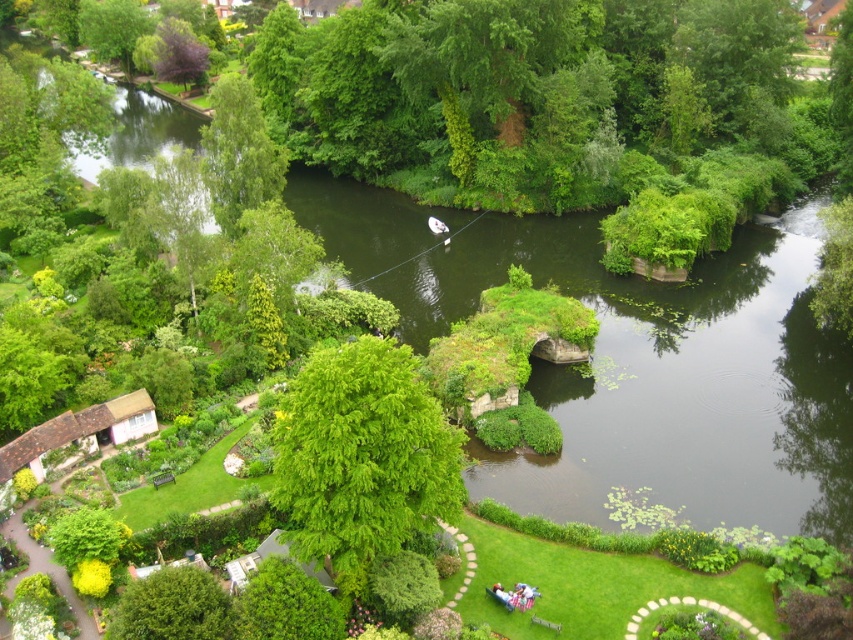
Question: Which object appears farthest from the camera in this image?

Choices:
 (A) green leafy tree at center
 (B) green leafy tree at lower left
 (C) purple leafy tree at upper left
 (D) green leafy tree at upper left

Answer: (C)

Question: Is green leafy tree at center below green leafy tree at upper left?

Choices:
 (A) no
 (B) yes

Answer: (B)

Question: Can you confirm if green leafy tree at upper left is smaller than green leafy tree at lower left?

Choices:
 (A) no
 (B) yes

Answer: (A)

Question: Which point appears closest to the camera in this image?

Choices:
 (A) (386, 522)
 (B) (177, 588)
 (C) (238, 172)
 (D) (161, 45)

Answer: (B)

Question: Can you confirm if green leafy tree at center is positioned to the left of purple leafy tree at upper left?

Choices:
 (A) no
 (B) yes

Answer: (A)

Question: Which object is the farthest from the green leafy tree at lower left?

Choices:
 (A) green leafy tree at upper left
 (B) purple leafy tree at upper left

Answer: (B)